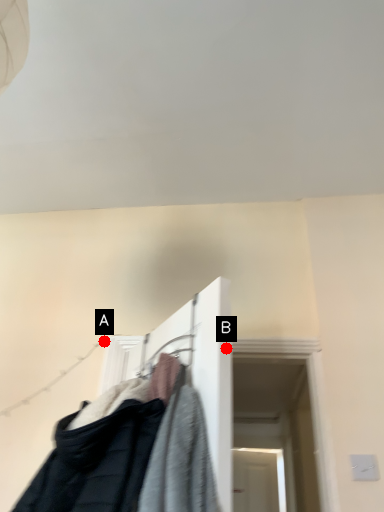
Question: Two points are circled on the image, labeled by A and B beside each circle. Which point is further to the camera?

Choices:
 (A) A is further
 (B) B is further

Answer: (A)